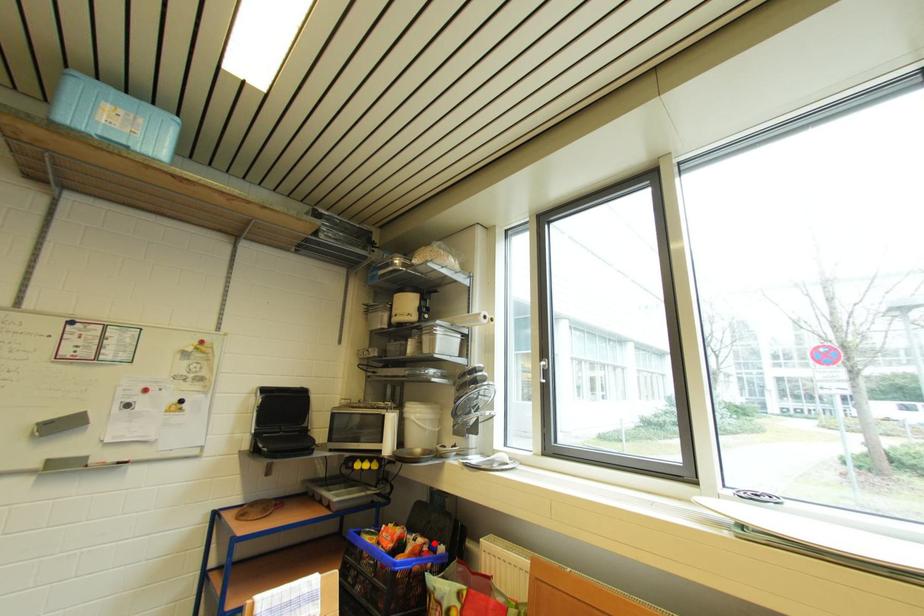
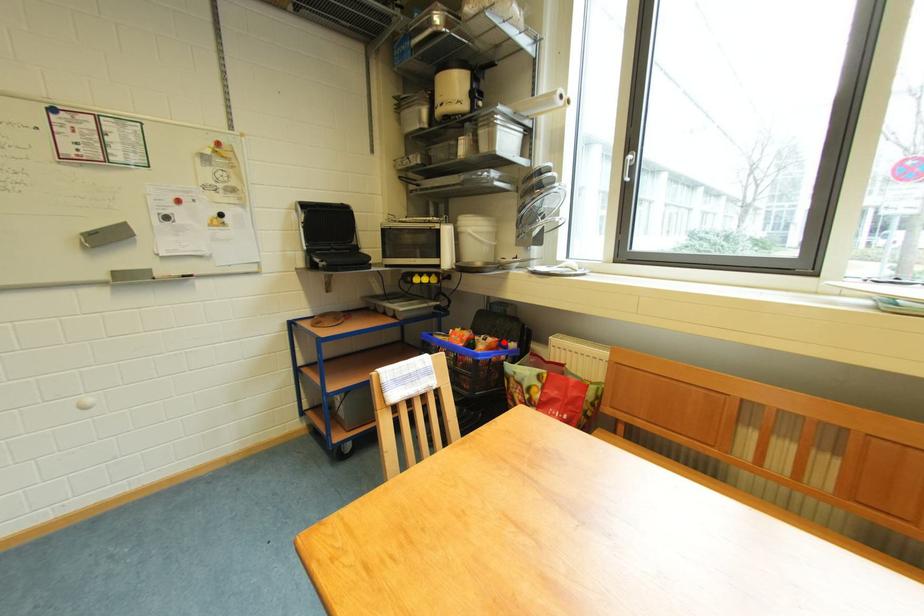
I am providing you with two images of the same scene from different viewpoints. A red point is marked on the first image and another point is marked on the second image. Does the point marked in image1 correspond to the same location as the one in image2?

Yes